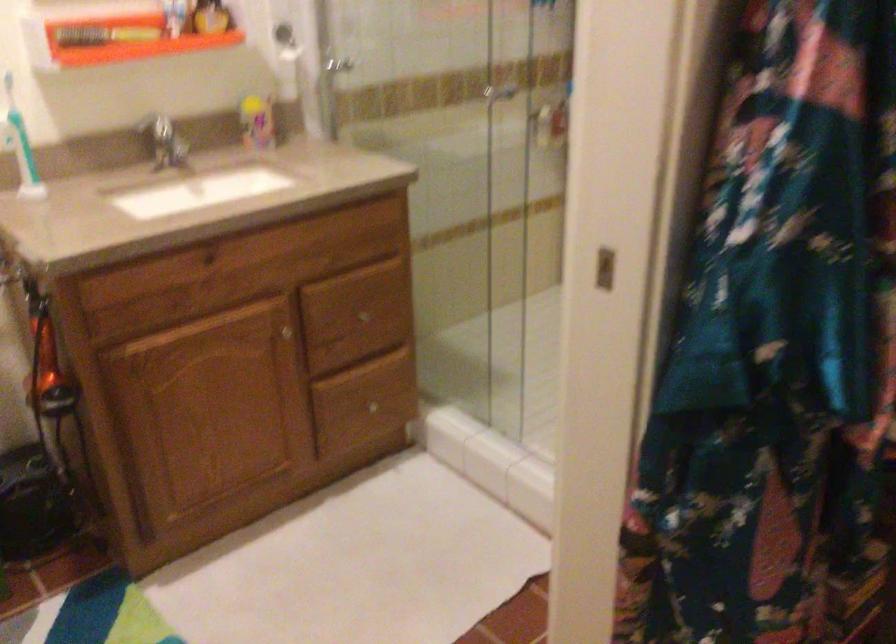
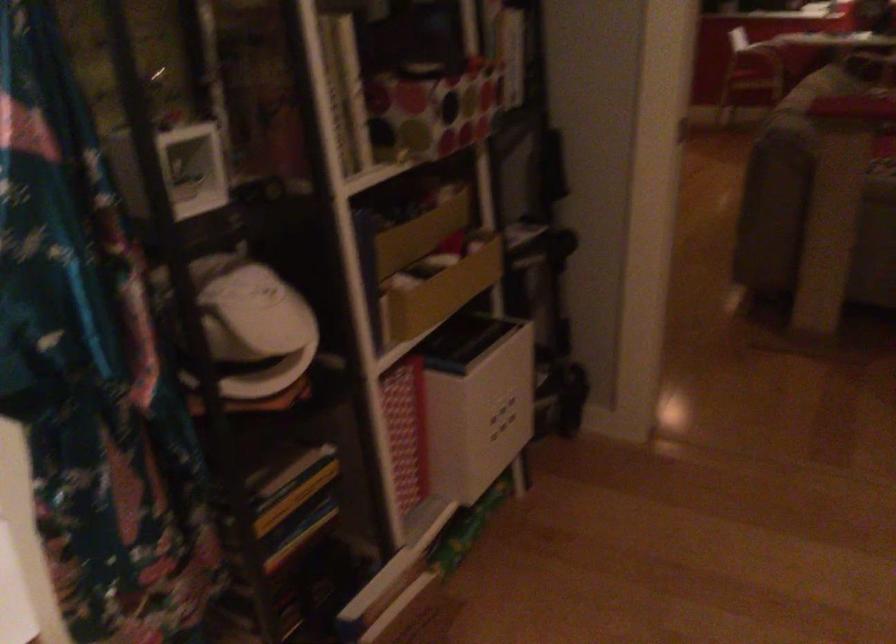
Question: The first image is from the beginning of the video and the second image is from the end. How did the camera likely rotate when shooting the video?

Choices:
 (A) Left
 (B) Right
 (C) Up
 (D) Down

Answer: (B)